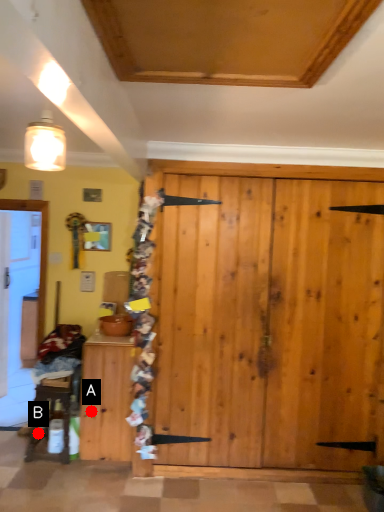
Question: Two points are circled on the image, labeled by A and B beside each circle. Among these points, which one is nearest to the camera?

Choices:
 (A) A is closer
 (B) B is closer

Answer: (A)